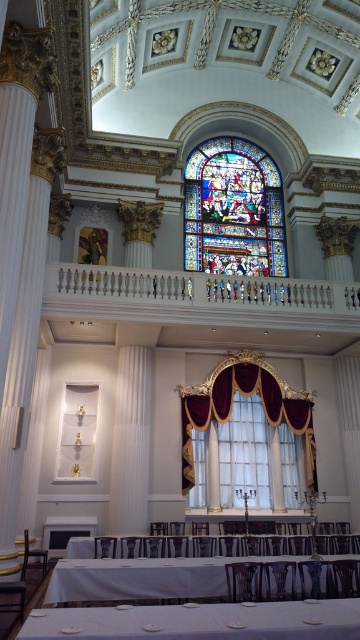
How far apart are white matte table at lower center and white glossy table at lower center?

The distance of white matte table at lower center from white glossy table at lower center is 48.68 feet.

Locate an element on the screen. The width and height of the screenshot is (360, 640). white matte table at lower center is located at coordinates pos(200,621).

Is white matte table at lower center bigger than velvet drapery at center?

Incorrect, white matte table at lower center is not larger than velvet drapery at center.

Which is above, white matte table at lower center or velvet drapery at center?

velvet drapery at center

Who is more distant from viewer, (231, 612) or (281, 417)?

The point (281, 417) is behind.

Where is `white matte table at lower center`? The width and height of the screenshot is (360, 640). white matte table at lower center is located at coordinates (200, 621).

Is velvet drapery at center positioned behind velvet curtain at center?

Yes, it is.

Does point (183, 408) come farther from viewer compared to point (123, 410)?

Yes, it is behind point (123, 410).

Between point (236, 381) and point (141, 417), which one is positioned behind?

The point (236, 381) is more distant.

Find the location of a particular element. The width and height of the screenshot is (360, 640). velvet drapery at center is located at coordinates (245, 396).